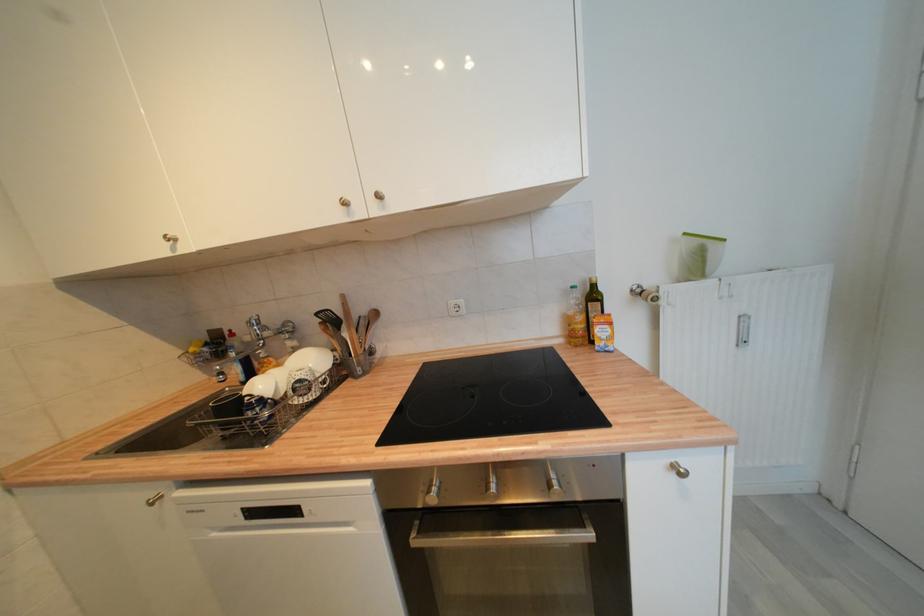
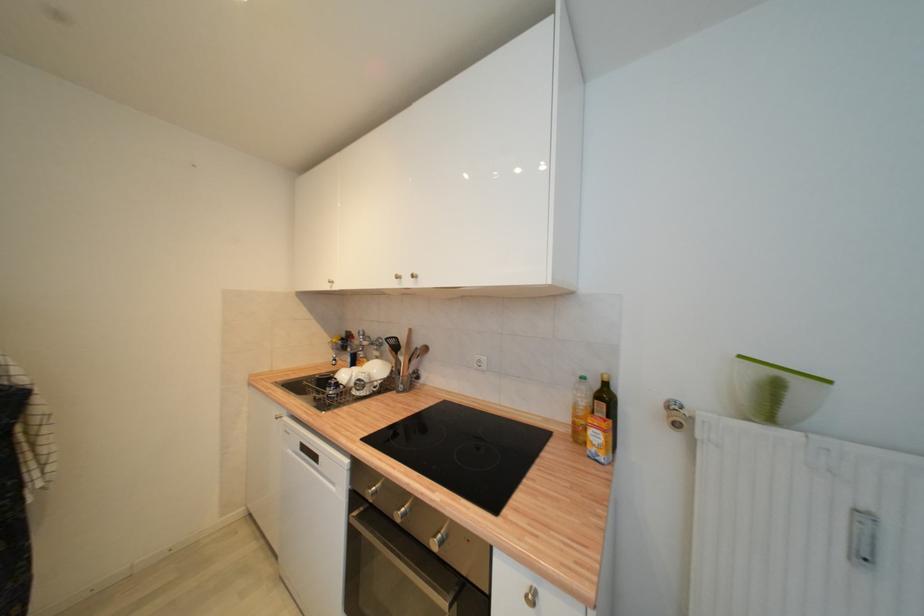
In the second image, find the point that corresponds to pixel 589 302 in the first image.

(596, 397)